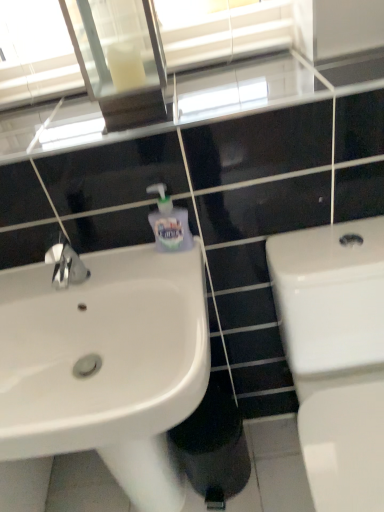
Identify the location of spots to the right of clear glass mirror at upper center. (203, 82).